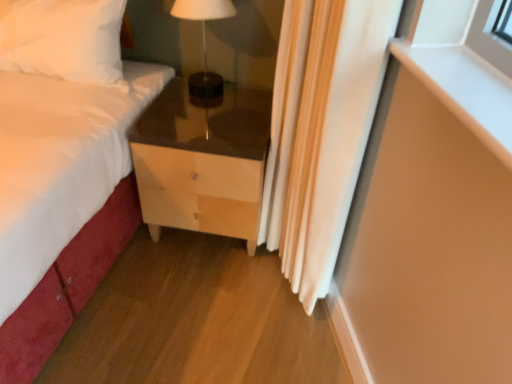
Image resolution: width=512 pixels, height=384 pixels. Find the location of `vacant region to the right of matte brown table lamp at center`. vacant region to the right of matte brown table lamp at center is located at coordinates (247, 96).